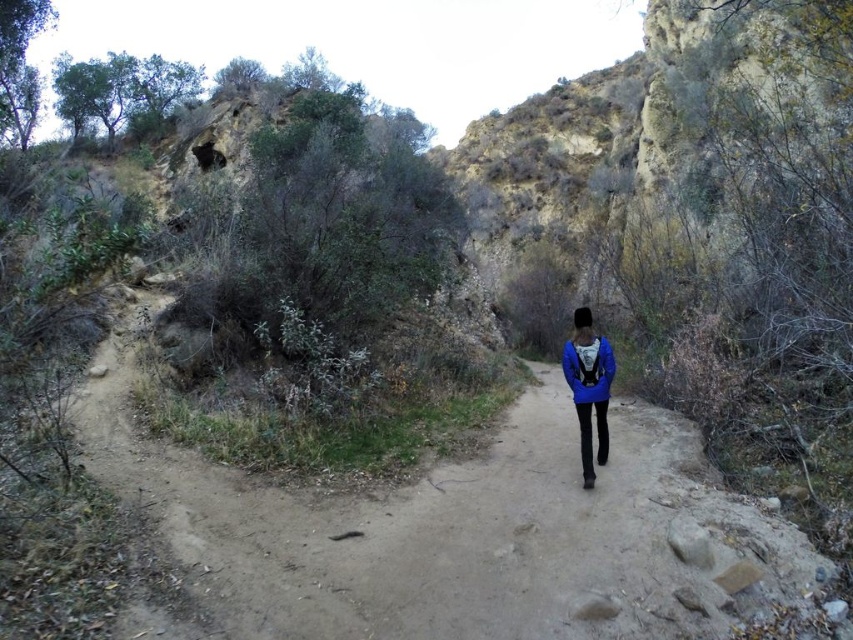
Which is more to the right, dirt path at center or blue matte jacket at center?

From the viewer's perspective, blue matte jacket at center appears more on the right side.

Can you confirm if dirt path at center is wider than blue matte jacket at center?

Yes, dirt path at center is wider than blue matte jacket at center.

Who is more forward, (271, 541) or (575, 401)?

Positioned in front is point (271, 541).

Find the location of a particular element. dirt path at center is located at coordinates (461, 531).